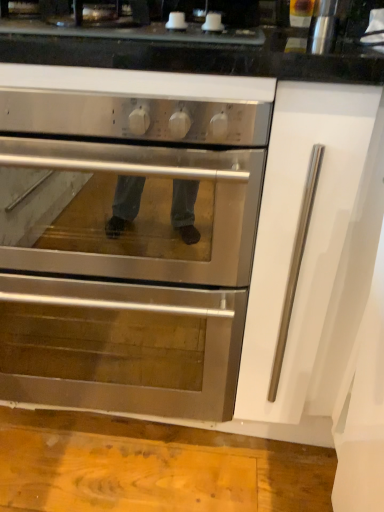
Question: From a real-world perspective, is satin black cooktop at upper center located higher than metallic cylindrical container at upper right?

Choices:
 (A) yes
 (B) no

Answer: (B)

Question: From a real-world perspective, is satin black cooktop at upper center physically below metallic cylindrical container at upper right?

Choices:
 (A) no
 (B) yes

Answer: (B)

Question: Can you confirm if satin black cooktop at upper center is wider than metallic cylindrical container at upper right?

Choices:
 (A) yes
 (B) no

Answer: (A)

Question: Is satin black cooktop at upper center bigger than metallic cylindrical container at upper right?

Choices:
 (A) yes
 (B) no

Answer: (A)

Question: Considering the relative positions of satin black cooktop at upper center and metallic cylindrical container at upper right in the image provided, is satin black cooktop at upper center behind metallic cylindrical container at upper right?

Choices:
 (A) no
 (B) yes

Answer: (A)

Question: Considering the positions of metallic cylindrical container at upper right and stainless steel oven at center in the image, is metallic cylindrical container at upper right wider or thinner than stainless steel oven at center?

Choices:
 (A) thin
 (B) wide

Answer: (A)

Question: Is point (334, 13) positioned closer to the camera than point (92, 316)?

Choices:
 (A) farther
 (B) closer

Answer: (B)

Question: From the image's perspective, is metallic cylindrical container at upper right positioned above or below stainless steel oven at center?

Choices:
 (A) above
 (B) below

Answer: (A)

Question: Would you say metallic cylindrical container at upper right is to the left or to the right of stainless steel oven at center in the picture?

Choices:
 (A) right
 (B) left

Answer: (A)

Question: In terms of height, does satin black cooktop at upper center look taller or shorter compared to metallic cylindrical container at upper right?

Choices:
 (A) tall
 (B) short

Answer: (B)

Question: Does point (205, 73) appear closer or farther from the camera than point (337, 26)?

Choices:
 (A) closer
 (B) farther

Answer: (A)

Question: From a real-world perspective, is satin black cooktop at upper center above or below metallic cylindrical container at upper right?

Choices:
 (A) below
 (B) above

Answer: (A)

Question: Is satin black cooktop at upper center in front of or behind metallic cylindrical container at upper right in the image?

Choices:
 (A) behind
 (B) front

Answer: (B)

Question: From a real-world perspective, is stainless steel oven at center physically located above or below satin black cooktop at upper center?

Choices:
 (A) below
 (B) above

Answer: (A)

Question: In the image, is stainless steel oven at center on the left side or the right side of satin black cooktop at upper center?

Choices:
 (A) right
 (B) left

Answer: (B)